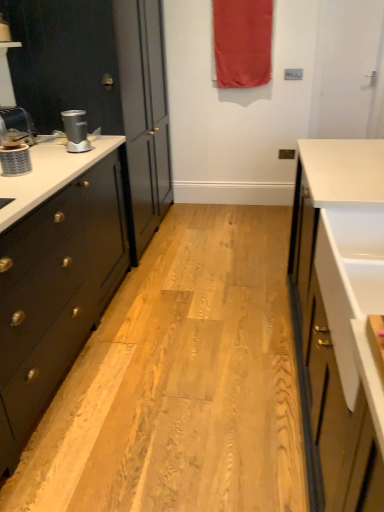
Question: From a real-world perspective, is silver metallic coffee machine at left physically below red fabric curtain at upper center?

Choices:
 (A) no
 (B) yes

Answer: (B)

Question: Is silver metallic coffee machine at left at the right side of red fabric curtain at upper center?

Choices:
 (A) yes
 (B) no

Answer: (B)

Question: Is silver metallic coffee machine at left outside red fabric curtain at upper center?

Choices:
 (A) yes
 (B) no

Answer: (A)

Question: Considering the relative positions of silver metallic coffee machine at left and red fabric curtain at upper center in the image provided, is silver metallic coffee machine at left to the left of red fabric curtain at upper center from the viewer's perspective?

Choices:
 (A) no
 (B) yes

Answer: (B)

Question: Can you confirm if silver metallic coffee machine at left is taller than red fabric curtain at upper center?

Choices:
 (A) yes
 (B) no

Answer: (B)

Question: From a real-world perspective, is brushed metal faucet at left physically located above or below red fabric curtain at upper center?

Choices:
 (A) above
 (B) below

Answer: (B)

Question: Based on their positions, is brushed metal faucet at left located to the left or right of red fabric curtain at upper center?

Choices:
 (A) right
 (B) left

Answer: (B)

Question: Is brushed metal faucet at left bigger or smaller than red fabric curtain at upper center?

Choices:
 (A) small
 (B) big

Answer: (A)

Question: Considering their positions, is brushed metal faucet at left located in front of or behind red fabric curtain at upper center?

Choices:
 (A) behind
 (B) front

Answer: (B)

Question: Looking at their shapes, would you say silver metallic coffee machine at left is wider or thinner than red fabric curtain at upper center?

Choices:
 (A) thin
 (B) wide

Answer: (B)

Question: Is silver metallic coffee machine at left taller or shorter than red fabric curtain at upper center?

Choices:
 (A) short
 (B) tall

Answer: (A)

Question: Is silver metallic coffee machine at left to the left or to the right of red fabric curtain at upper center in the image?

Choices:
 (A) left
 (B) right

Answer: (A)

Question: In the image, is silver metallic coffee machine at left positioned in front of or behind red fabric curtain at upper center?

Choices:
 (A) behind
 (B) front

Answer: (B)

Question: Looking at their shapes, would you say matte black cabinet at left is wider or thinner than matte silver blender at left?

Choices:
 (A) wide
 (B) thin

Answer: (A)

Question: In the image, is matte black cabinet at left positioned in front of or behind matte silver blender at left?

Choices:
 (A) front
 (B) behind

Answer: (B)